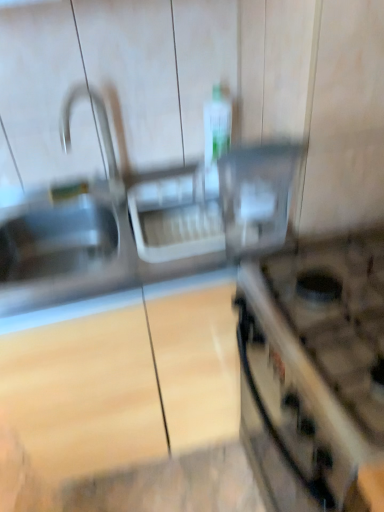
Identify the location of free space to the left of translucent plastic bottle at center. The image size is (384, 512). (169, 175).